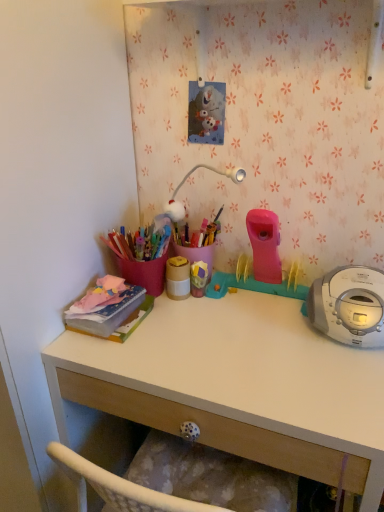
Image resolution: width=384 pixels, height=512 pixels. Find the location of `space that is in front of matte pink notebook at left, which is counted as the 2th office supplies, starting from the right`. space that is in front of matte pink notebook at left, which is counted as the 2th office supplies, starting from the right is located at coordinates (114, 356).